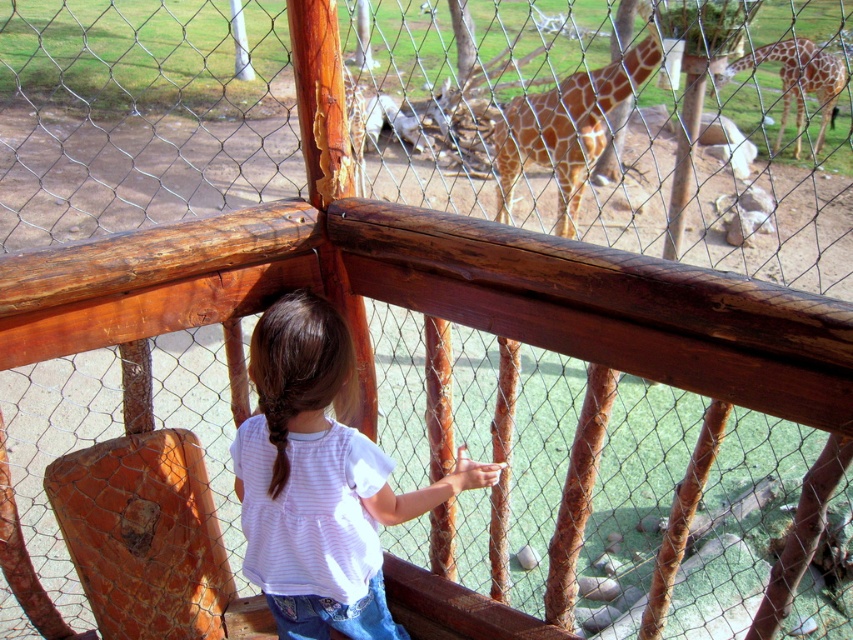
Based on the photo, you are a zookeeper planning to install a new sign between the white striped shirt at center and the spotted brown giraffe at center. Based on their widths, which object should the sign be closer to?

The white striped shirt at center has a lesser width compared to the spotted brown giraffe at center, so the sign should be placed closer to the white striped shirt at center to account for its smaller size.

You are a zookeeper who needs to feed the spotted brown giraffe at center. The feeding tool you have can reach up to 6 meters. Can you reach the giraffe with your current tool?

The spotted brown giraffe at center is 6.89 meters from the camera, which is beyond the 6 meters reach of the feeding tool. Therefore, you cannot reach the giraffe with your current tool.

You are standing in front of the zoo enclosure and see the spotted brown giraffe at center and the spotted fur giraffe at upper right. Which giraffe is closer to you?

The spotted brown giraffe at center is closer to you because it is positioned under the spotted fur giraffe at upper right, indicating it is in front.